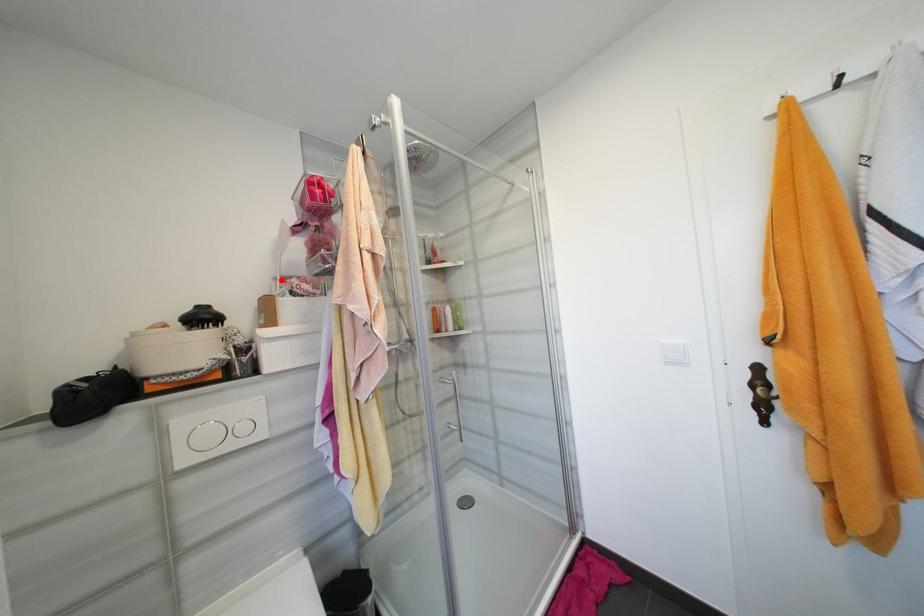
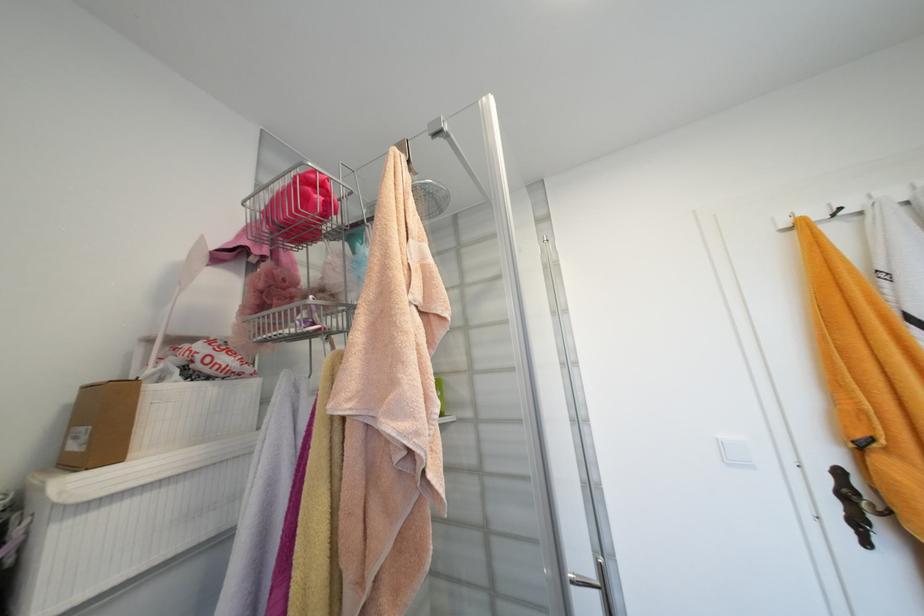
In the second image, find the point that corresponds to the highlighted location in the first image.

(154, 342)